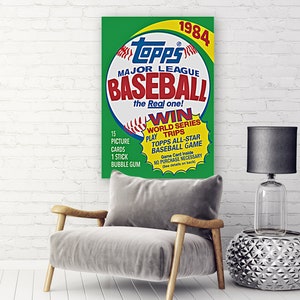
Find the location of `lamp`. lamp is located at coordinates (270, 202).